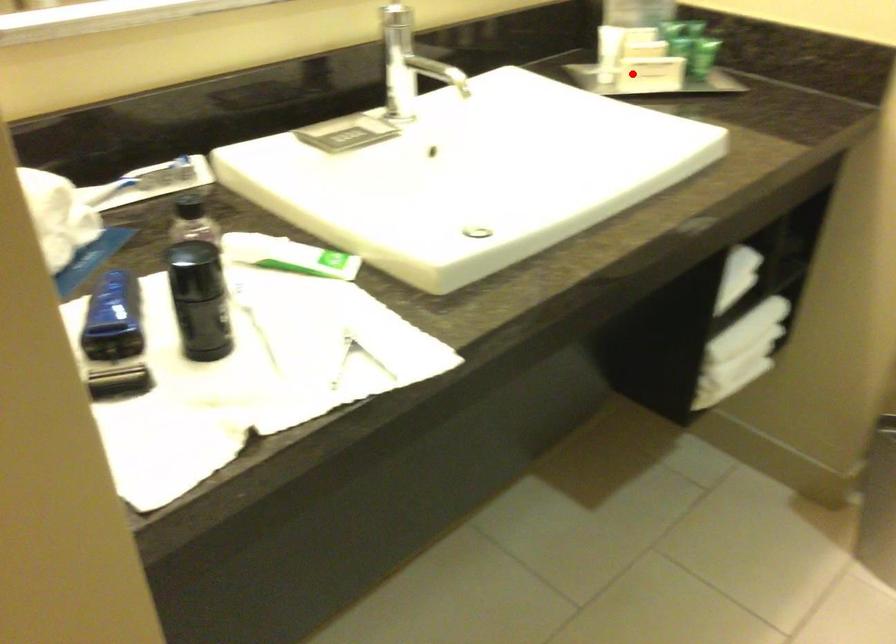
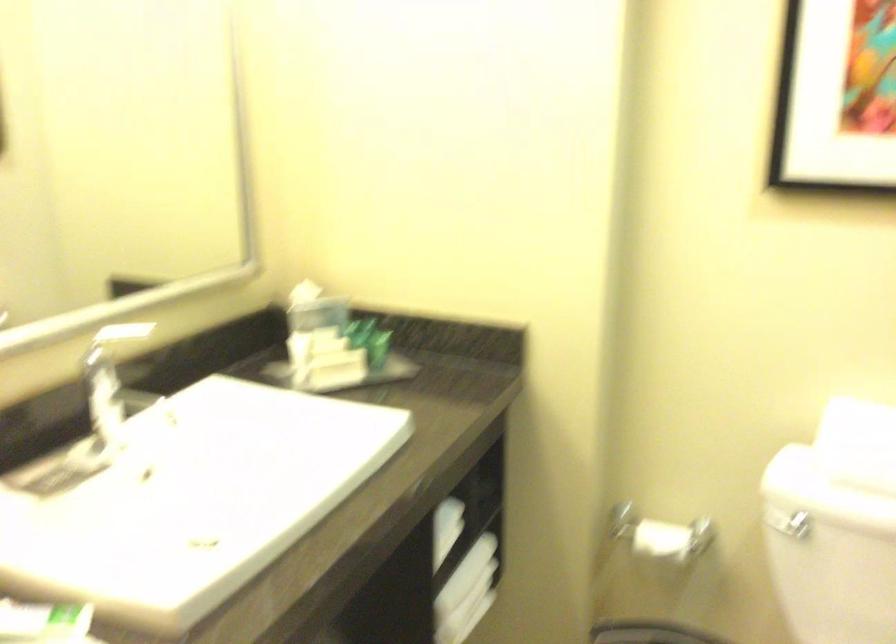
Question: I am providing you with two images of the same scene from different viewpoints. Image1 has a red point marked. In image2, the corresponding 3D location appears at what relative position? Reply with the corresponding letter.

Choices:
 (A) Closer
 (B) Farther

Answer: (B)